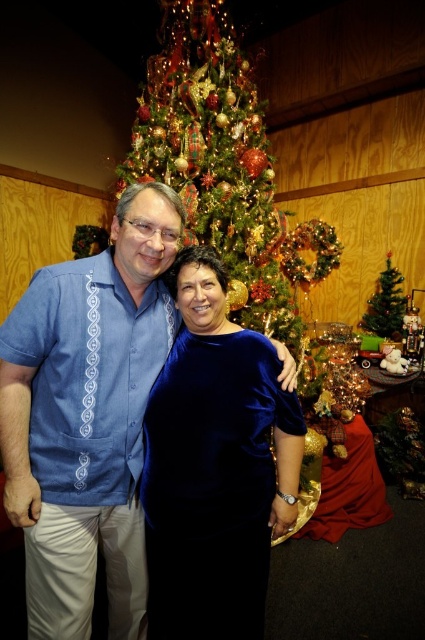
Between blue satin blouse at center and green matte christmas tree at center, which one has more height?

With more height is blue satin blouse at center.

Between point (147, 301) and point (390, 307), which one is positioned in front?

Positioned in front is point (147, 301).

This screenshot has width=425, height=640. What do you see at coordinates (87, 416) in the screenshot?
I see `blue satin blouse at center` at bounding box center [87, 416].

Find the location of `blue satin blouse at center`. blue satin blouse at center is located at coordinates (87, 416).

Can you confirm if blue satin blouse at center is thinner than velvet blue dress at center?

Indeed, blue satin blouse at center has a lesser width compared to velvet blue dress at center.

Between blue satin blouse at center and velvet blue dress at center, which one appears on the left side from the viewer's perspective?

blue satin blouse at center is more to the left.

Which is behind, point (102, 285) or point (240, 500)?

The point (102, 285) is behind.

Locate an element on the screen. This screenshot has height=640, width=425. blue satin blouse at center is located at coordinates (87, 416).

Which is in front, point (150, 586) or point (385, 280)?

Positioned in front is point (150, 586).

Between velvet blue dress at center and green matte christmas tree at center, which one appears on the left side from the viewer's perspective?

velvet blue dress at center

Identify the location of velvet blue dress at center. (214, 465).

What are the coordinates of `velvet blue dress at center` in the screenshot? It's located at (214, 465).